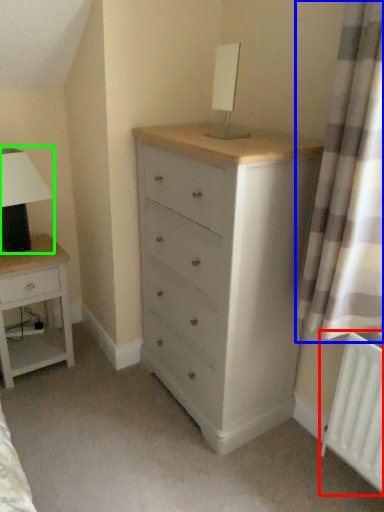
Question: Which is farther away from radiator (highlighted by a red box)? curtain (highlighted by a blue box) or table lamp (highlighted by a green box)?

Choices:
 (A) curtain
 (B) table lamp

Answer: (B)